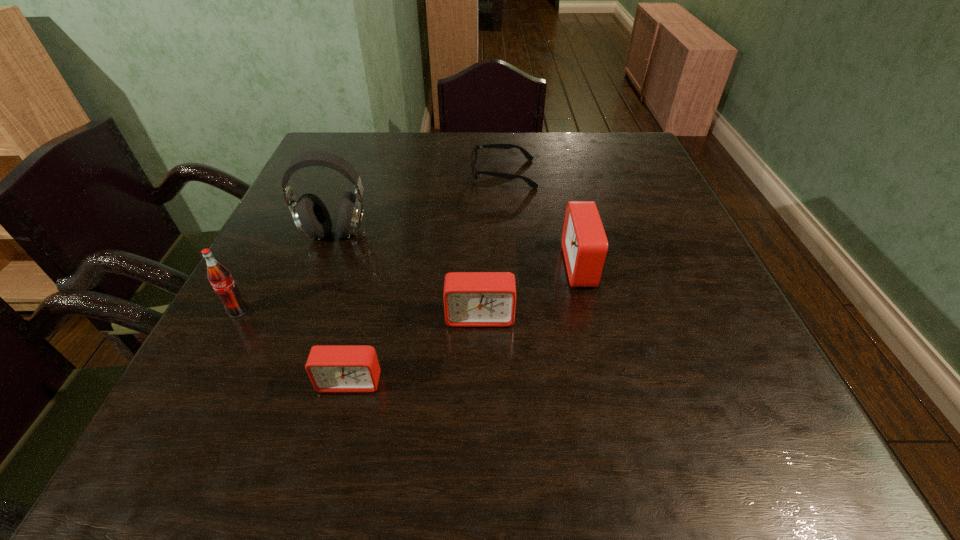
Where is `free space for a new alarm clock on the right`? free space for a new alarm clock on the right is located at coordinates (662, 225).